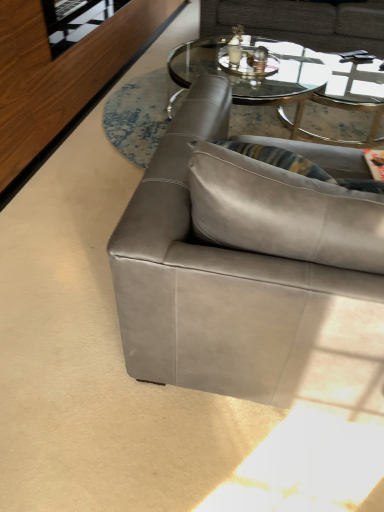
Question: Considering the relative sizes of transparent glass coffee table at center and transparent glass door at upper left in the image provided, is transparent glass coffee table at center bigger than transparent glass door at upper left?

Choices:
 (A) no
 (B) yes

Answer: (B)

Question: From a real-world perspective, is transparent glass coffee table at center on top of transparent glass door at upper left?

Choices:
 (A) no
 (B) yes

Answer: (A)

Question: Can you confirm if transparent glass coffee table at center is smaller than transparent glass door at upper left?

Choices:
 (A) yes
 (B) no

Answer: (B)

Question: Can you confirm if transparent glass coffee table at center is taller than transparent glass door at upper left?

Choices:
 (A) no
 (B) yes

Answer: (B)

Question: Is transparent glass coffee table at center at the right side of transparent glass door at upper left?

Choices:
 (A) yes
 (B) no

Answer: (A)

Question: From a real-world perspective, is suede gray couch at center, positioned as the 1th studio couch in front-to-back order, above or below gray leather couch at upper center, the first studio couch positioned from the back?

Choices:
 (A) above
 (B) below

Answer: (A)

Question: Looking at the image, does suede gray couch at center, acting as the second studio couch starting from the top, seem bigger or smaller compared to gray leather couch at upper center, which appears as the second studio couch when ordered from the bottom?

Choices:
 (A) small
 (B) big

Answer: (A)

Question: Is suede gray couch at center, positioned as the 1th studio couch in front-to-back order, inside or outside of gray leather couch at upper center, which appears as the second studio couch when ordered from the bottom?

Choices:
 (A) outside
 (B) inside

Answer: (A)

Question: Considering their positions, is suede gray couch at center, arranged as the first studio couch when ordered from the bottom, located in front of or behind gray leather couch at upper center, which appears as the second studio couch when ordered from the bottom?

Choices:
 (A) behind
 (B) front

Answer: (B)

Question: In the image, is suede gray couch at center, arranged as the first studio couch when ordered from the bottom, positioned in front of or behind transparent glass door at upper left?

Choices:
 (A) front
 (B) behind

Answer: (A)

Question: In terms of size, does suede gray couch at center, arranged as the first studio couch when ordered from the bottom, appear bigger or smaller than transparent glass door at upper left?

Choices:
 (A) small
 (B) big

Answer: (B)

Question: Would you say suede gray couch at center, positioned as the 1th studio couch in front-to-back order, is to the left or to the right of transparent glass door at upper left in the picture?

Choices:
 (A) right
 (B) left

Answer: (A)

Question: Considering the positions of suede gray couch at center, the 2th studio couch when ordered from back to front, and transparent glass door at upper left in the image, is suede gray couch at center, the 2th studio couch when ordered from back to front, taller or shorter than transparent glass door at upper left?

Choices:
 (A) tall
 (B) short

Answer: (A)

Question: Considering the positions of gray leather couch at upper center, placed as the 1th studio couch when sorted from top to bottom, and transparent glass door at upper left in the image, is gray leather couch at upper center, placed as the 1th studio couch when sorted from top to bottom, taller or shorter than transparent glass door at upper left?

Choices:
 (A) tall
 (B) short

Answer: (A)

Question: Is gray leather couch at upper center, acting as the second studio couch starting from the front, to the left or to the right of transparent glass door at upper left in the image?

Choices:
 (A) left
 (B) right

Answer: (B)